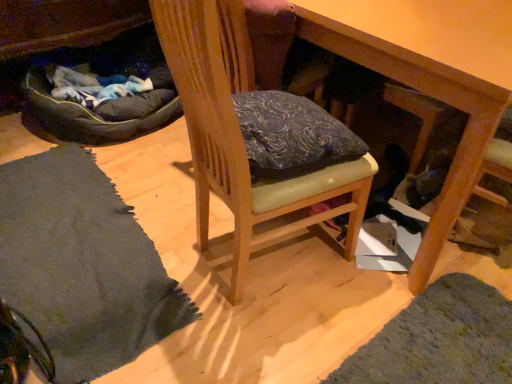
Question: Could you tell me if soft gray rug at lower left is facing wooden table at center?

Choices:
 (A) no
 (B) yes

Answer: (A)

Question: Is soft gray rug at lower left looking in the opposite direction of wooden table at center?

Choices:
 (A) yes
 (B) no

Answer: (B)

Question: From a real-world perspective, is soft gray rug at lower left positioned under wooden table at center based on gravity?

Choices:
 (A) no
 (B) yes

Answer: (A)

Question: Is there a large distance between soft gray rug at lower left and wooden table at center?

Choices:
 (A) no
 (B) yes

Answer: (A)

Question: From the image's perspective, is soft gray rug at lower left on top of wooden table at center?

Choices:
 (A) no
 (B) yes

Answer: (A)

Question: Would you say wooden table at center is part of soft gray rug at lower left's contents?

Choices:
 (A) no
 (B) yes

Answer: (A)

Question: From the image's perspective, is dark gray fabric bean bag at left below wooden table at center?

Choices:
 (A) no
 (B) yes

Answer: (A)

Question: Is dark gray fabric bean bag at left further to the viewer compared to wooden table at center?

Choices:
 (A) no
 (B) yes

Answer: (B)

Question: From the image's perspective, is dark gray fabric bean bag at left on top of wooden table at center?

Choices:
 (A) no
 (B) yes

Answer: (B)

Question: Is wooden table at center surrounded by dark gray fabric bean bag at left?

Choices:
 (A) no
 (B) yes

Answer: (A)

Question: From a real-world perspective, is dark gray fabric bean bag at left physically below wooden table at center?

Choices:
 (A) no
 (B) yes

Answer: (B)

Question: Is the position of dark gray fabric bean bag at left less distant than that of wooden table at center?

Choices:
 (A) yes
 (B) no

Answer: (B)

Question: Does wooden table at center lie in front of wooden chair at center?

Choices:
 (A) yes
 (B) no

Answer: (B)